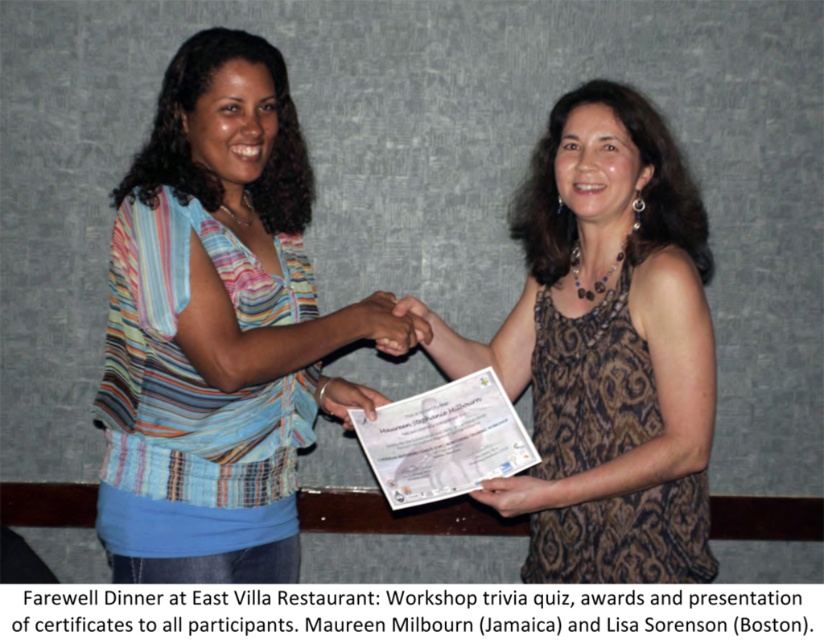
Question: Where is brown textured dress at center located in relation to matte skin at center in the image?

Choices:
 (A) above
 (B) below

Answer: (A)

Question: Which point is closer to the camera?

Choices:
 (A) (345, 316)
 (B) (368, 336)

Answer: (A)

Question: Among these objects, which one is nearest to the camera?

Choices:
 (A) striped fabric blouse at center
 (B) matte skin at center

Answer: (A)

Question: Is brown textured dress at center smaller than matte skin at center?

Choices:
 (A) no
 (B) yes

Answer: (A)

Question: Can you confirm if brown textured dress at center is positioned above matte skin at center?

Choices:
 (A) yes
 (B) no

Answer: (A)

Question: Based on their relative distances, which object is nearer to the striped fabric blouse at center?

Choices:
 (A) brown textured dress at center
 (B) matte skin at center

Answer: (B)